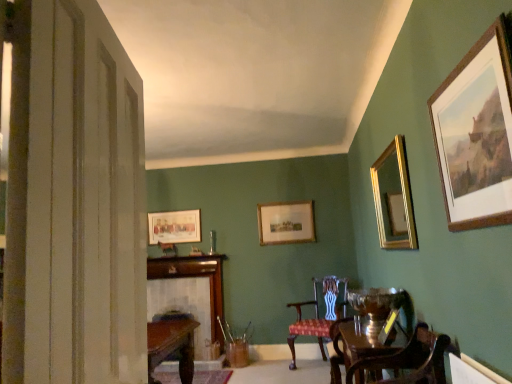
Identify the location of blank space situated above wooden picture frame at upper right, positioned as the 1th picture frame in front-to-back order (from a real-world perspective). (455, 64).